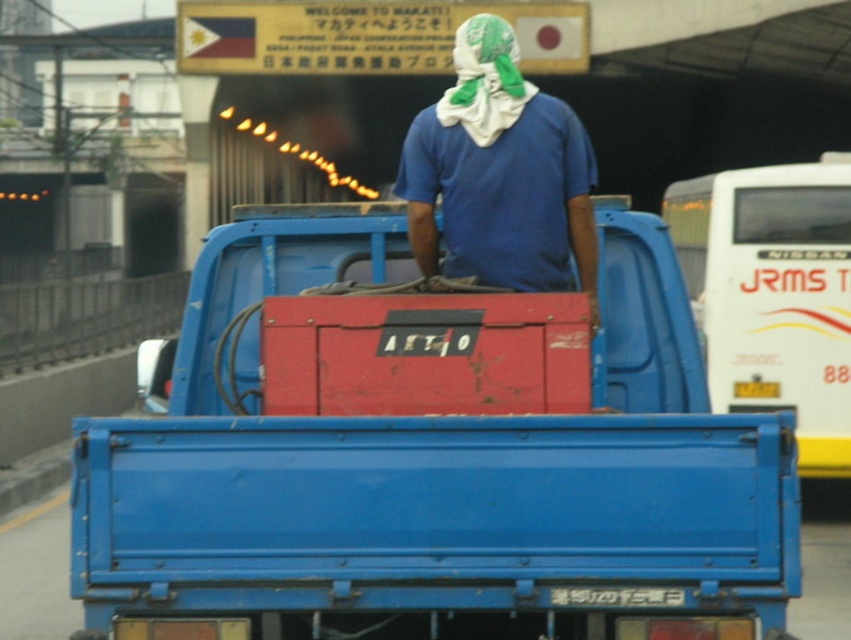
Locate an element on the screen. blue plastic truck at right is located at coordinates (774, 294).

Measure the distance between point (x=672, y=204) and camera.

A distance of 20.93 meters exists between point (x=672, y=204) and camera.

The image size is (851, 640). Identify the location of blue plastic truck at right. (x=774, y=294).

Which of these two, matte red toolbox at center or blue plastic truck at right, stands taller?

With more height is blue plastic truck at right.

Can you confirm if matte red toolbox at center is positioned to the left of blue plastic truck at right?

Yes, matte red toolbox at center is to the left of blue plastic truck at right.

Is point (454, 320) positioned before point (849, 372)?

Yes, point (454, 320) is closer to viewer.

At what (x,y) coordinates should I click in order to perform the action: click on matte red toolbox at center. Please return your answer as a coordinate pair (x, y). The image size is (851, 640). Looking at the image, I should click on (429, 452).

In order to click on matte red toolbox at center in this screenshot , I will do `click(429, 452)`.

Who is higher up, matte red toolbox at center or green cotton headscarf at upper center?

green cotton headscarf at upper center

Which is behind, point (141, 353) or point (461, 88)?

The point (141, 353) is more distant.

The width and height of the screenshot is (851, 640). In order to click on matte red toolbox at center in this screenshot , I will do `click(429, 452)`.